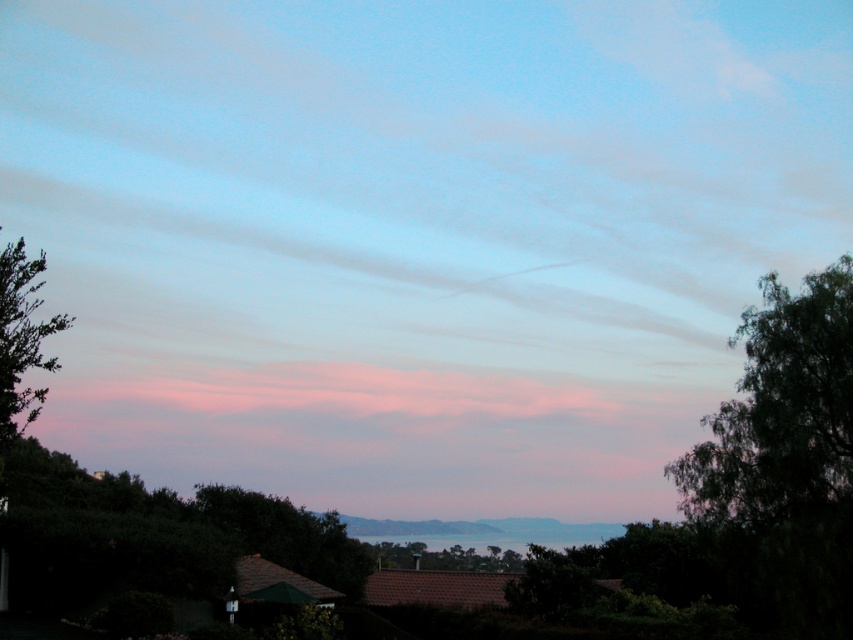
Does green leafy tree at left have a greater height compared to green leafy tree at center?

No, green leafy tree at left is not taller than green leafy tree at center.

Can you confirm if green leafy tree at left is positioned below green leafy tree at center?

Actually, green leafy tree at left is above green leafy tree at center.

Who is more forward, (65, 314) or (436, 560)?

Point (65, 314) is in front.

Where is `green leafy tree at left`? green leafy tree at left is located at coordinates (21, 339).